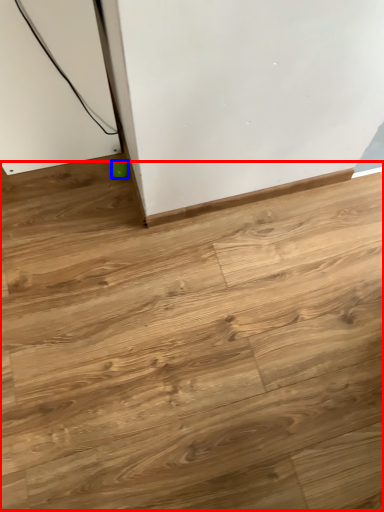
Question: Which object appears closest to the camera in this image, plywood (highlighted by a red box) or ball (highlighted by a blue box)?

Choices:
 (A) plywood
 (B) ball

Answer: (A)